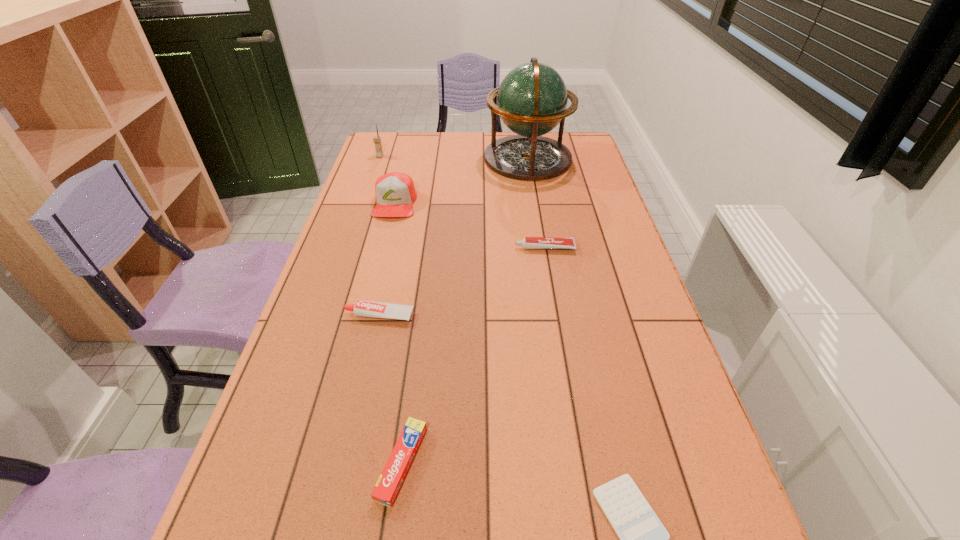
Where is `globe situated at the far edge`? globe situated at the far edge is located at coordinates (532, 99).

This screenshot has width=960, height=540. I want to click on cellular telephone situated at the far edge, so pos(377,140).

Where is `cellular telephone located at the left edge`? The image size is (960, 540). cellular telephone located at the left edge is located at coordinates [377, 140].

Where is `baseball cap present at the left edge`? Image resolution: width=960 pixels, height=540 pixels. baseball cap present at the left edge is located at coordinates (x=395, y=193).

I want to click on toothpaste located at the left edge, so click(362, 308).

Find the location of `globe situated at the right edge`. globe situated at the right edge is located at coordinates (532, 99).

Find the location of `toothpaste that is at the right edge`. toothpaste that is at the right edge is located at coordinates (528, 242).

You are a GUI agent. You are given a task and a screenshot of the screen. Output one action in this format:
    pyautogui.click(x=<x>, y=<y>)
    Task: Click on the object located at the far left corner
    This screenshot has width=960, height=540.
    Given the screenshot: What is the action you would take?
    pyautogui.click(x=377, y=140)

Identify the location of object at the far right corner. The image size is (960, 540). (532, 99).

This screenshot has height=540, width=960. Identify the location of vacant space at the far edge of the desktop. (447, 136).